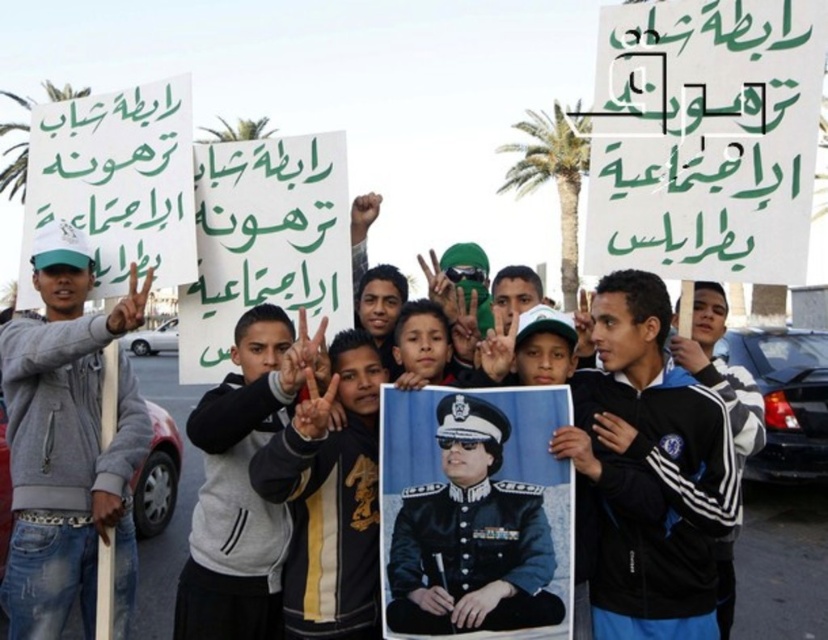
Does black matte jacket at center have a greater width compared to dark blue uniform at center?

Yes.

Between point (703, 397) and point (338, 525), which one is positioned behind?

Point (338, 525)

In order to click on black matte jacket at center in this screenshot , I will do pyautogui.click(x=656, y=470).

Between green paper sign at upper center and black matte jacket at center, which one appears on the right side from the viewer's perspective?

From the viewer's perspective, green paper sign at upper center appears more on the right side.

The width and height of the screenshot is (828, 640). In order to click on green paper sign at upper center in this screenshot , I will do `click(705, 138)`.

Is point (749, 168) positioned in front of point (677, 608)?

No, it is behind (677, 608).

Identify the location of green paper sign at upper center. (705, 138).

From the picture: Does green paper sign at upper center have a greater width compared to uniformed officer portrait at center?

Indeed, green paper sign at upper center has a greater width compared to uniformed officer portrait at center.

Between green paper sign at upper center and uniformed officer portrait at center, which one appears on the left side from the viewer's perspective?

uniformed officer portrait at center is more to the left.

Is point (621, 90) positioned after point (489, 618)?

Yes, point (621, 90) is behind point (489, 618).

Image resolution: width=828 pixels, height=640 pixels. I want to click on green paper sign at upper center, so click(705, 138).